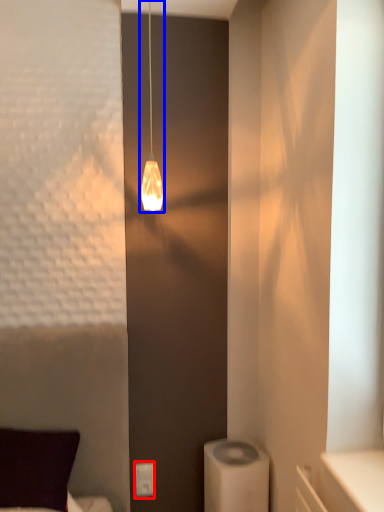
Question: Which of the following is the farthest to the observer, light switch (highlighted by a red box) or lamp (highlighted by a blue box)?

Choices:
 (A) light switch
 (B) lamp

Answer: (A)